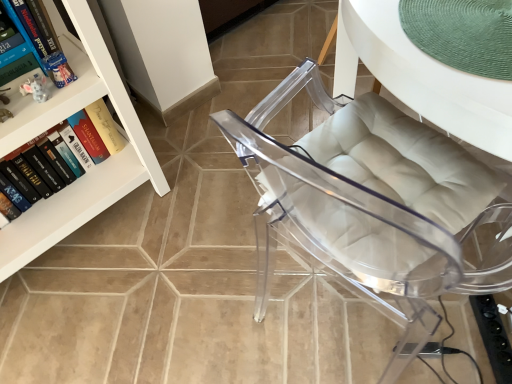
Locate an element on the screen. free space in front of white glossy bookcase at upper left is located at coordinates (97, 321).